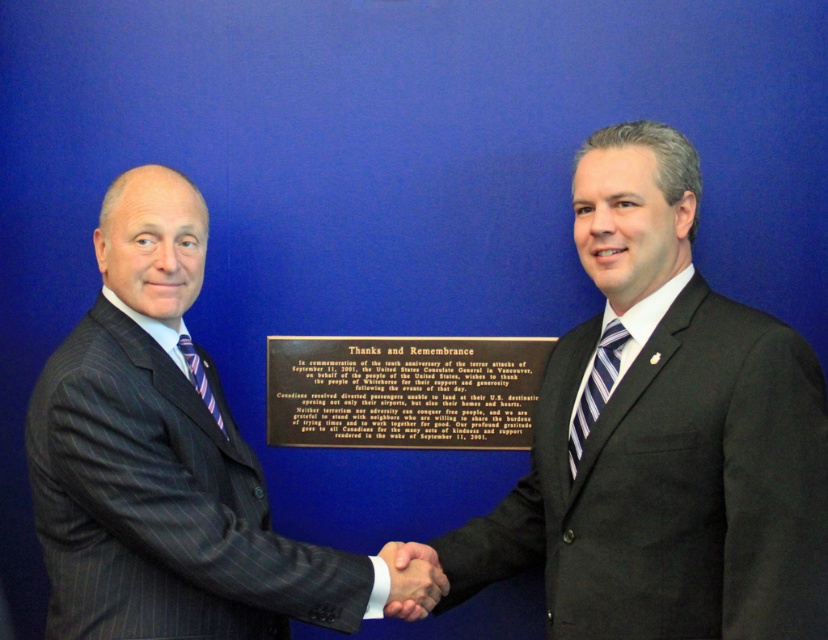
Which of these two, matte black suit at center or dark gray pinstripe suit at center, stands taller?

Standing taller between the two is matte black suit at center.

From the picture: Is matte black suit at center smaller than dark gray pinstripe suit at center?

Incorrect, matte black suit at center is not smaller in size than dark gray pinstripe suit at center.

Who is more forward, [747,573] or [335,616]?

Positioned in front is point [747,573].

At what (x,y) coordinates should I click in order to perform the action: click on matte black suit at center. Please return your answer as a coordinate pair (x, y). The width and height of the screenshot is (828, 640). Looking at the image, I should click on (663, 436).

Does dark gray pinstripe suit at center appear under striped fabric tie at left?

Correct, dark gray pinstripe suit at center is located below striped fabric tie at left.

Is dark gray pinstripe suit at center thinner than striped fabric tie at left?

In fact, dark gray pinstripe suit at center might be wider than striped fabric tie at left.

What do you see at coordinates (162, 460) in the screenshot? I see `dark gray pinstripe suit at center` at bounding box center [162, 460].

This screenshot has width=828, height=640. I want to click on dark gray pinstripe suit at center, so click(x=162, y=460).

Between striped fabric tie at center and striped fabric tie at left, which one is positioned higher?

striped fabric tie at left is above.

Between point (576, 460) and point (208, 390), which one is positioned in front?

Point (576, 460) is more forward.

Locate an element on the screen. striped fabric tie at center is located at coordinates (595, 388).